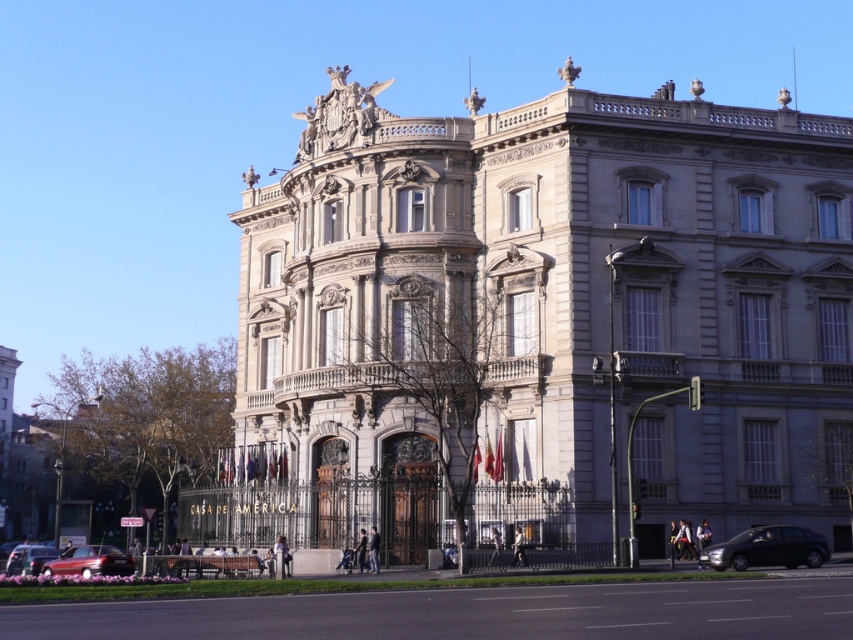
Question: Does gray stone palace at center appear on the right side of metallic silver car at lower left?

Choices:
 (A) yes
 (B) no

Answer: (A)

Question: Which of the following is the closest to the observer?

Choices:
 (A) (811, 548)
 (B) (96, 552)

Answer: (A)

Question: In this image, where is gray stone palace at center located relative to metallic silver car at lower left?

Choices:
 (A) left
 (B) right

Answer: (B)

Question: Among these points, which one is farthest from the camera?

Choices:
 (A) (x=68, y=550)
 (B) (x=715, y=568)
 (C) (x=589, y=360)
 (D) (x=20, y=563)

Answer: (D)

Question: Is shiny black sedan at lower right below metallic silver car at lower left?

Choices:
 (A) yes
 (B) no

Answer: (B)

Question: Which is nearer to the metallic silver car at lower left?

Choices:
 (A) gray stone palace at center
 (B) shiny black sedan at lower right
 (C) metallic red car at lower left

Answer: (C)